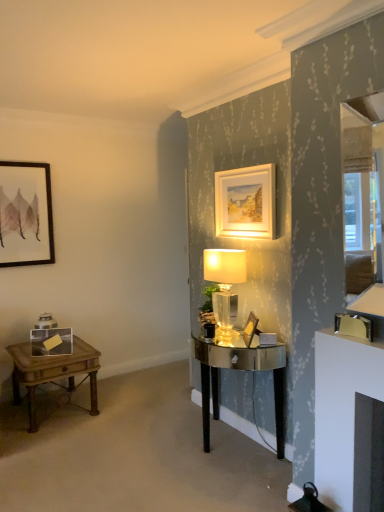
Question: Considering their positions, is translucent glass lamp at center located in front of or behind matte black picture frame at upper left, positioned as the second picture frame in top-to-bottom order?

Choices:
 (A) behind
 (B) front

Answer: (B)

Question: Looking at the image, does translucent glass lamp at center seem bigger or smaller compared to matte black picture frame at upper left, the 3th picture frame viewed from the front?

Choices:
 (A) big
 (B) small

Answer: (A)

Question: Which object is positioned farthest from the shiny metallic desk at center?

Choices:
 (A) wooden picture frame at center, which appears as the third picture frame when viewed from the top
 (B) matte gold picture frame at upper center, which appears as the 2th picture frame when viewed from the front
 (C) translucent glass lamp at center
 (D) matte black picture frame at upper left, which is counted as the 2th picture frame, starting from the bottom
 (E) wooden side table at left

Answer: (D)

Question: Which is farther from the translucent glass lamp at center?

Choices:
 (A) shiny metallic desk at center
 (B) matte black picture frame at upper left, arranged as the 3th picture frame when viewed from the right
 (C) matte gold picture frame at upper center, which is the first picture frame in top-to-bottom order
 (D) wooden picture frame at center, which appears as the third picture frame when viewed from the top
 (E) wooden side table at left

Answer: (B)